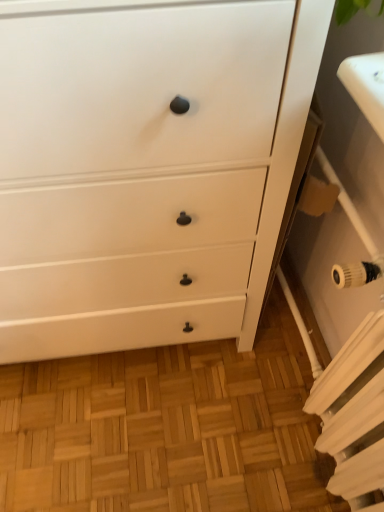
Question: Should I look upward or downward to see white matte chest of drawers at center?

Choices:
 (A) up
 (B) down

Answer: (A)

Question: From a real-world perspective, is white metallic radiator at lower right physically above white matte chest of drawers at center?

Choices:
 (A) yes
 (B) no

Answer: (A)

Question: Is white metallic radiator at lower right turned away from white matte chest of drawers at center?

Choices:
 (A) no
 (B) yes

Answer: (A)

Question: Is white metallic radiator at lower right at the left side of white matte chest of drawers at center?

Choices:
 (A) no
 (B) yes

Answer: (A)

Question: From the image's perspective, is white metallic radiator at lower right below white matte chest of drawers at center?

Choices:
 (A) yes
 (B) no

Answer: (A)

Question: Is white metallic radiator at lower right shorter than white matte chest of drawers at center?

Choices:
 (A) yes
 (B) no

Answer: (A)

Question: Can you confirm if white metallic radiator at lower right is wider than white matte chest of drawers at center?

Choices:
 (A) no
 (B) yes

Answer: (A)

Question: Is white matte chest of drawers at center outside white metallic radiator at lower right?

Choices:
 (A) yes
 (B) no

Answer: (A)

Question: From the image's perspective, is white matte chest of drawers at center below white metallic radiator at lower right?

Choices:
 (A) yes
 (B) no

Answer: (B)

Question: Are white matte chest of drawers at center and white metallic radiator at lower right far apart?

Choices:
 (A) no
 (B) yes

Answer: (A)

Question: Does white matte chest of drawers at center lie behind white metallic radiator at lower right?

Choices:
 (A) yes
 (B) no

Answer: (B)

Question: Is white matte chest of drawers at center wider than white metallic radiator at lower right?

Choices:
 (A) yes
 (B) no

Answer: (A)

Question: Is white matte chest of drawers at center bigger than white metallic radiator at lower right?

Choices:
 (A) no
 (B) yes

Answer: (B)

Question: From the image's perspective, relative to white metallic radiator at lower right, is white matte chest of drawers at center above or below?

Choices:
 (A) below
 (B) above

Answer: (B)